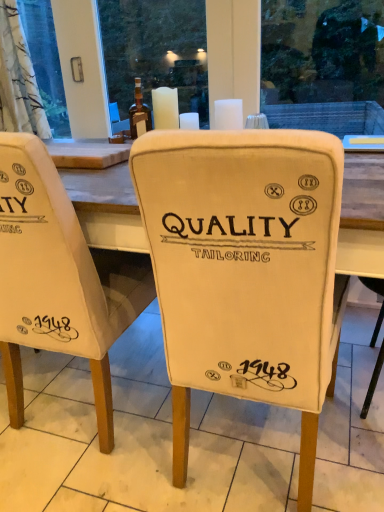
Identify the location of vacant region above white fabric chair at center (from a real-world perspective). (145, 435).